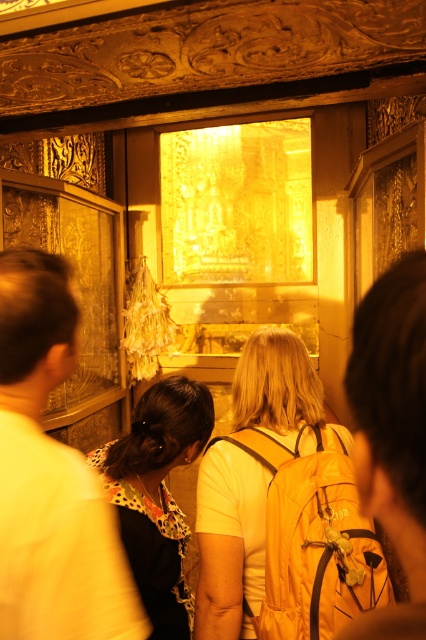
Question: Is yellow backpack at center thinner than yellow fabric backpack at center?

Choices:
 (A) yes
 (B) no

Answer: (A)

Question: Which point is closer to the camera?

Choices:
 (A) (192, 444)
 (B) (411, 332)

Answer: (B)

Question: Which of these objects is positioned closest to the yellow backpack at center?

Choices:
 (A) polka dot blouse at center
 (B) yellow fabric backpack at center
 (C) floral-patterned blouse at center

Answer: (A)

Question: Among these objects, which one is farthest from the camera?

Choices:
 (A) floral-patterned blouse at center
 (B) polka dot blouse at center

Answer: (A)

Question: Considering the relative positions of yellow fabric backpack at center and floral-patterned blouse at center in the image provided, where is yellow fabric backpack at center located with respect to floral-patterned blouse at center?

Choices:
 (A) right
 (B) left

Answer: (A)

Question: Can you confirm if polka dot blouse at center is bigger than yellow fabric backpack at center?

Choices:
 (A) no
 (B) yes

Answer: (A)